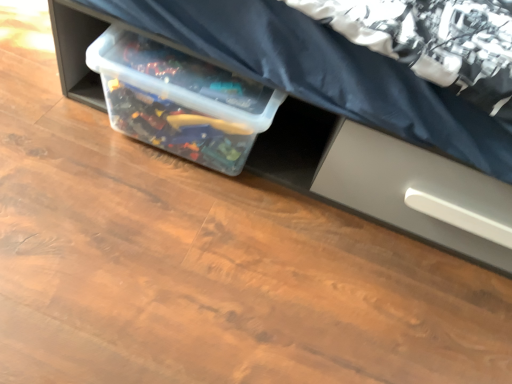
This screenshot has height=384, width=512. What are the coordinates of `free spot to the left of transparent plastic container at center` in the screenshot? It's located at (58, 120).